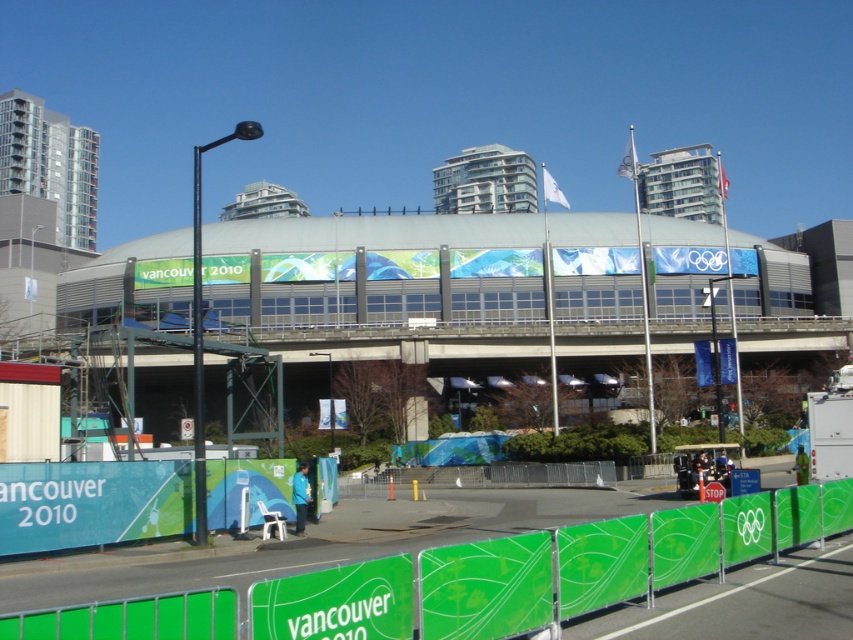
Question: Which of the following is the closest to the observer?

Choices:
 (A) green fabric barrier at lower center
 (B) green fabric at lower center

Answer: (A)

Question: Which object appears closest to the camera in this image?

Choices:
 (A) green fabric at lower center
 (B) green fabric barrier at lower center

Answer: (B)

Question: Considering the relative positions of green fabric barrier at lower center and green fabric at lower center in the image provided, where is green fabric barrier at lower center located with respect to green fabric at lower center?

Choices:
 (A) below
 (B) above

Answer: (B)

Question: Among these points, which one is farthest from the camera?

Choices:
 (A) (250, 625)
 (B) (109, 500)

Answer: (B)

Question: Considering the relative positions of green fabric barrier at lower center and green fabric at lower center in the image provided, where is green fabric barrier at lower center located with respect to green fabric at lower center?

Choices:
 (A) left
 (B) right

Answer: (B)

Question: Does green fabric barrier at lower center lie in front of green fabric at lower center?

Choices:
 (A) no
 (B) yes

Answer: (B)